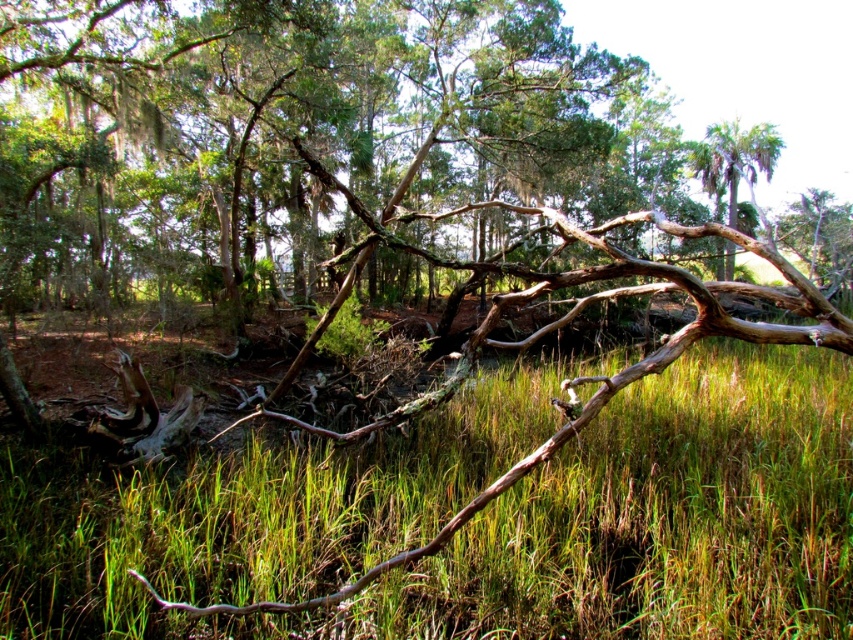
Is green matte grass at center shorter than green leafy palm tree at upper right?

Indeed, green matte grass at center has a lesser height compared to green leafy palm tree at upper right.

Does green matte grass at center appear under green leafy palm tree at upper right?

Correct, green matte grass at center is located below green leafy palm tree at upper right.

This screenshot has width=853, height=640. Identify the location of green matte grass at center. (473, 518).

Find the location of a particular element. The image size is (853, 640). green matte grass at center is located at coordinates (473, 518).